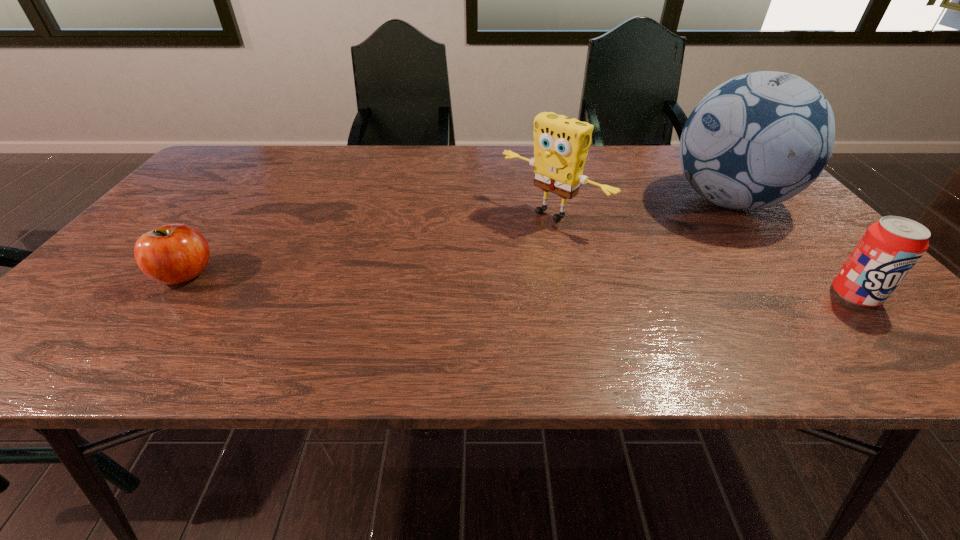
At what (x,y) coordinates should I click in order to perform the action: click on free spot between the shortest object and the soccer ball. Please return your answer as a coordinate pair (x, y). Looking at the image, I should click on (456, 238).

Find the location of a particular element. The image size is (960, 540). vacant region between the third tallest object and the shortest object is located at coordinates (520, 285).

You are a GUI agent. You are given a task and a screenshot of the screen. Output one action in this format:
    pyautogui.click(x=<x>, y=<y>)
    Task: Click on the free point between the leftmost object and the soda can
    The width and height of the screenshot is (960, 540).
    Given the screenshot: What is the action you would take?
    click(x=520, y=285)

Locate an element on the screen. free space between the sponge and the apple is located at coordinates (369, 244).

This screenshot has height=540, width=960. What are the coordinates of `unoccupied area between the soccer ball and the sponge` in the screenshot? It's located at (640, 207).

The width and height of the screenshot is (960, 540). In order to click on vacant area that lies between the tallest object and the third shortest object in this screenshot , I will do `click(640, 207)`.

You are a GUI agent. You are given a task and a screenshot of the screen. Output one action in this format:
    pyautogui.click(x=<x>, y=<y>)
    Task: Click on the vacant point located between the soda can and the soccer ball
    
    Given the screenshot: What is the action you would take?
    (x=791, y=248)

Find the location of a particular element. The image size is (960, 540). object that is the second closest to the second shortest object is located at coordinates (561, 144).

Point out which object is positioned as the second nearest to the tallest object. Please provide its 2D coordinates. Your answer should be formatted as a tuple, i.e. [(x, y)], where the tuple contains the x and y coordinates of a point satisfying the conditions above.

[(561, 144)]

Where is `vacant space that satisfies the following two spatial constraints: 1. on the back side of the soccer ball; 2. on the right side of the apple`? vacant space that satisfies the following two spatial constraints: 1. on the back side of the soccer ball; 2. on the right side of the apple is located at coordinates (242, 201).